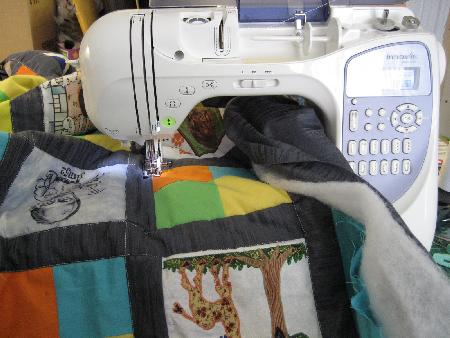
Identify the location of screen. The height and width of the screenshot is (338, 450). (395, 72).